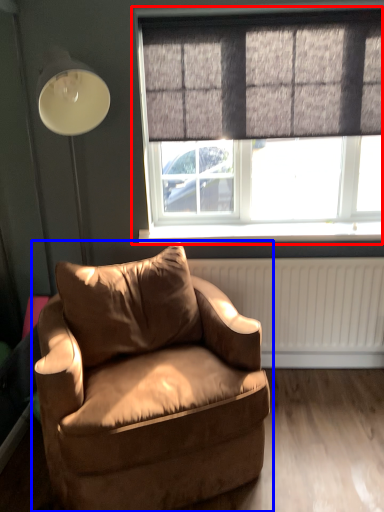
Question: Which point is further to the camera, window (highlighted by a red box) or chair (highlighted by a blue box)?

Choices:
 (A) window
 (B) chair

Answer: (A)